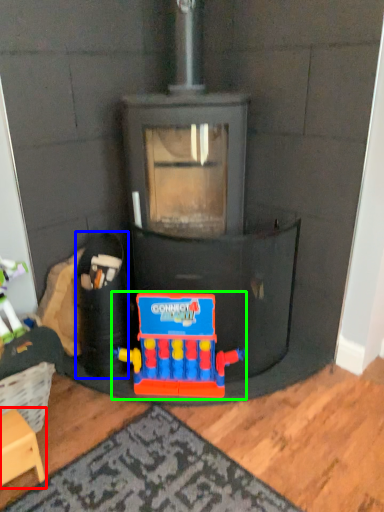
Question: Which object is the closest to the furniture (highlighted by a red box)? Choose among these: toy (highlighted by a blue box) or toy (highlighted by a green box).

Choices:
 (A) toy
 (B) toy

Answer: (A)